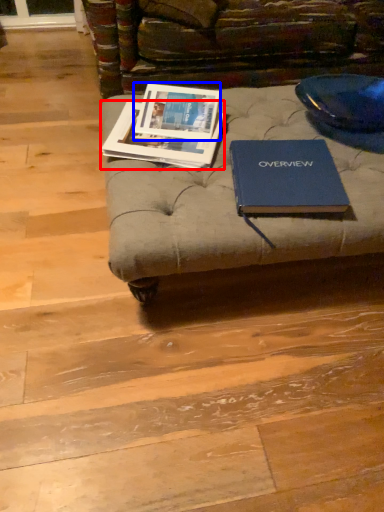
Question: Which point is closer to the camera, book (highlighted by a red box) or book cover (highlighted by a blue box)?

Choices:
 (A) book
 (B) book cover

Answer: (A)